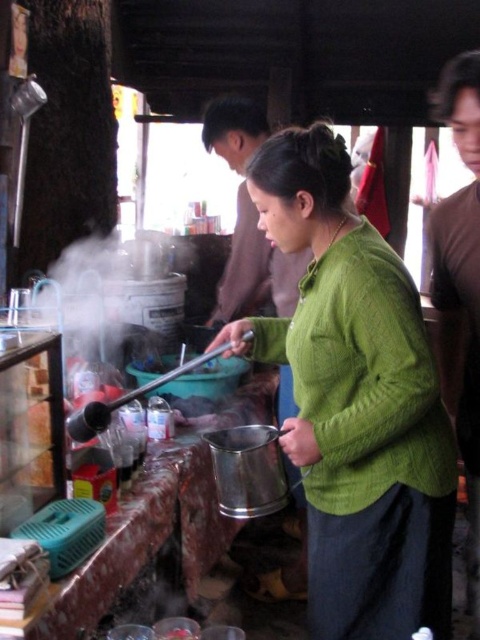
You are a photographer trying to capture the scene of the kitchen. You notice the green knitted sweater at center and the brown cotton shirt at upper right. Which clothing item should you focus on first if you want to photograph the one that is higher in the frame?

The green knitted sweater at center is located above the brown cotton shirt at upper right, so you should focus on the green knitted sweater at center first as it is higher in the frame.

You are a photographer trying to capture the scene in the kitchen. You notice the green knitted sweater at center and the brown cotton shirt at upper right. Which clothing item is closer to the left side of the frame?

The green knitted sweater at center is positioned on the left side of the brown cotton shirt at upper right, so it is closer to the left side of the frame.